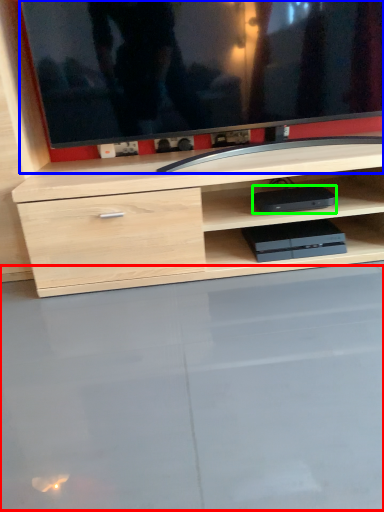
Question: Considering the real-world distances, which object is closest to glass table (highlighted by a red box)? television (highlighted by a blue box) or equipment (highlighted by a green box).

Choices:
 (A) television
 (B) equipment

Answer: (B)